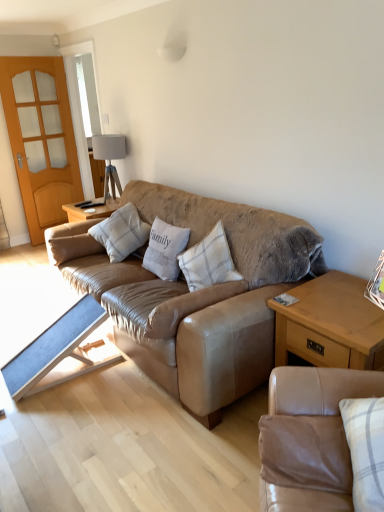
Question: Is light wood/texture side table at lower right, which is the first table from right to left, situated inside light brown wooden screen door at left or outside?

Choices:
 (A) outside
 (B) inside

Answer: (A)

Question: In terms of height, does light wood/texture side table at lower right, which is the first table from right to left, look taller or shorter compared to light brown wooden screen door at left?

Choices:
 (A) tall
 (B) short

Answer: (B)

Question: Which is farther from the white fabric lampshade at upper center?

Choices:
 (A) tan leather couch at lower right, positioned as the first studio couch in bottom-to-top order
 (B) white cotton pillow at center, which is the 3th pillow from left to right
 (C) light brown wooden screen door at left
 (D) blue fabric table at lower left, which appears as the 2th table when viewed from the right
 (E) plaid fabric pillow at center, which ranks as the third pillow in right-to-left order

Answer: (A)

Question: Estimate the real-world distances between objects in this image. Which object is farther from the white cotton pillow at center, which is the 3th pillow from left to right?

Choices:
 (A) leather couch at center, the first studio couch positioned from the top
 (B) light brown wooden screen door at left
 (C) blue fabric table at lower left, the first table when ordered from left to right
 (D) light gray textured pillow at center, which appears as the 4th pillow when viewed from the right
 (E) light wood/texture side table at lower right, which is the 2th table from left to right

Answer: (B)